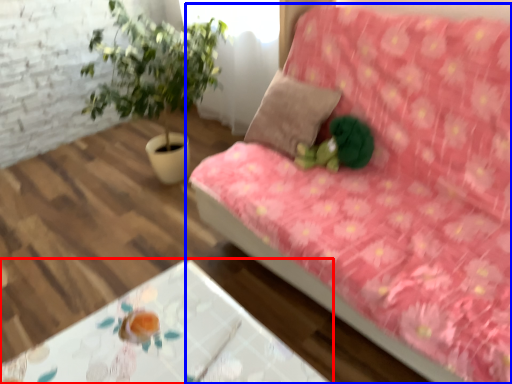
Question: Which object is further to the camera taking this photo, table (highlighted by a red box) or studio couch (highlighted by a blue box)?

Choices:
 (A) table
 (B) studio couch

Answer: (A)